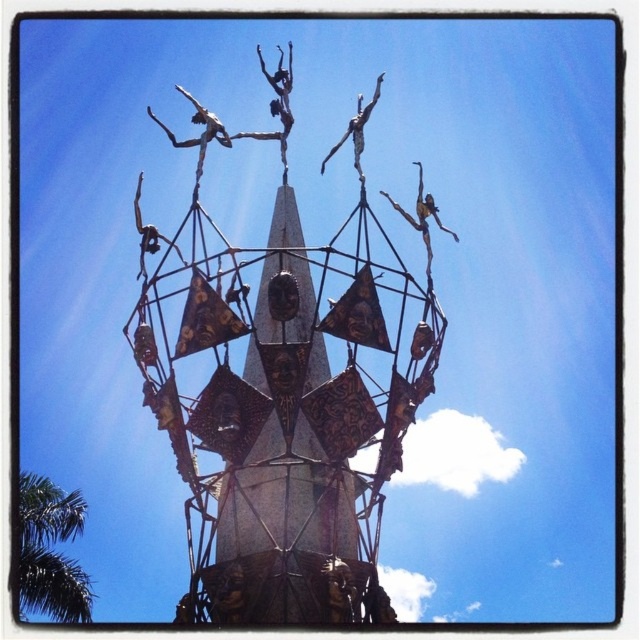
You are an artist planning to paint this sculpture scene. You need to decide which object to focus on first based on their sizes. Which one should you paint first, the green leafy tree at lower left or the polished bronze dancers at upper center?

The green leafy tree at lower left is bigger than the polished bronze dancers at upper center, so you should paint the green leafy tree at lower left first to capture its larger presence in the scene.

You are standing in front of the sculpture and want to take a photo of the polished bronze dancers at upper center without the green leafy tree at lower left blocking the view. Is there a position where you can do this?

The polished bronze dancers at upper center are behind the green leafy tree at lower left, so you cannot take a photo of the polished bronze dancers at upper center without the green leafy tree at lower left blocking the view.

You are an artist planning to paint this scene. You want to ensure the green leafy tree at lower left and the polished bronze dancers at upper center are proportionally accurate. Which object should you make wider in your painting?

The green leafy tree at lower left should be made wider in the painting since its width is larger than the polished bronze dancers at upper center.